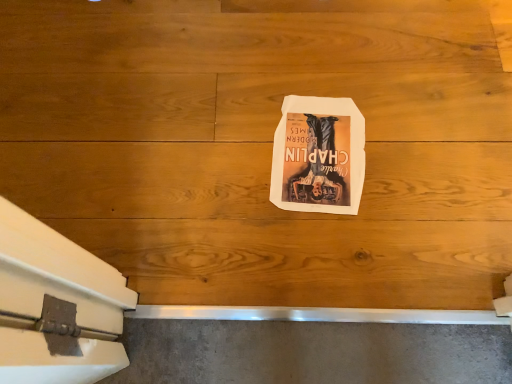
The width and height of the screenshot is (512, 384). Find the location of `vacant position to the left of white paper at center`. vacant position to the left of white paper at center is located at coordinates (208, 142).